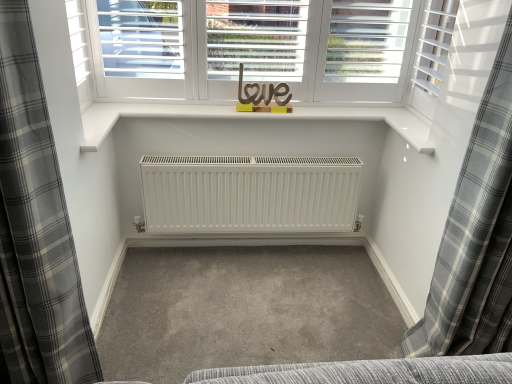
Question: Considering the positions of point (463, 327) and point (436, 81), is point (463, 327) closer or farther from the camera than point (436, 81)?

Choices:
 (A) farther
 (B) closer

Answer: (B)

Question: Based on their sizes in the image, would you say gray plaid curtain at right, which ranks as the first curtain in right-to-left order, is bigger or smaller than white matte shutter at upper right?

Choices:
 (A) small
 (B) big

Answer: (B)

Question: Which is farther from the gray plaid curtain at left, acting as the first curtain starting from the left?

Choices:
 (A) white matte shutter at upper right
 (B) gray plaid curtain at right, placed as the second curtain when sorted from left to right

Answer: (A)

Question: Which is nearer to the white matte shutter at upper right?

Choices:
 (A) gray plaid curtain at right, which ranks as the first curtain in right-to-left order
 (B) gray plaid curtain at left, acting as the first curtain starting from the left

Answer: (A)